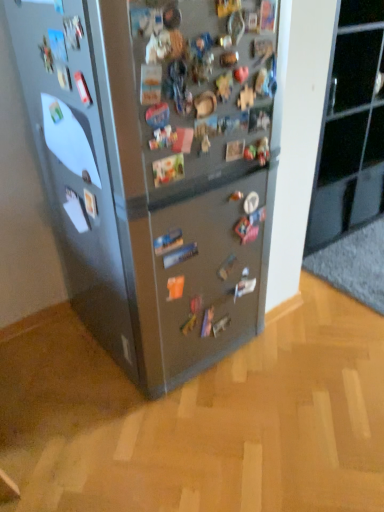
Question: In terms of size, does glossy black cabinet at upper right appear bigger or smaller than satin silver fridge at center?

Choices:
 (A) small
 (B) big

Answer: (A)

Question: Is glossy black cabinet at upper right inside the boundaries of satin silver fridge at center, or outside?

Choices:
 (A) outside
 (B) inside

Answer: (A)

Question: Considering the positions of glossy black cabinet at upper right and satin silver fridge at center in the image, is glossy black cabinet at upper right taller or shorter than satin silver fridge at center?

Choices:
 (A) short
 (B) tall

Answer: (A)

Question: Considering the positions of satin silver fridge at center and glossy black cabinet at upper right in the image, is satin silver fridge at center bigger or smaller than glossy black cabinet at upper right?

Choices:
 (A) small
 (B) big

Answer: (B)

Question: Considering the positions of satin silver fridge at center and glossy black cabinet at upper right in the image, is satin silver fridge at center taller or shorter than glossy black cabinet at upper right?

Choices:
 (A) tall
 (B) short

Answer: (A)

Question: Is satin silver fridge at center situated inside glossy black cabinet at upper right or outside?

Choices:
 (A) outside
 (B) inside

Answer: (A)

Question: From a real-world perspective, relative to glossy black cabinet at upper right, is satin silver fridge at center vertically above or below?

Choices:
 (A) below
 (B) above

Answer: (B)